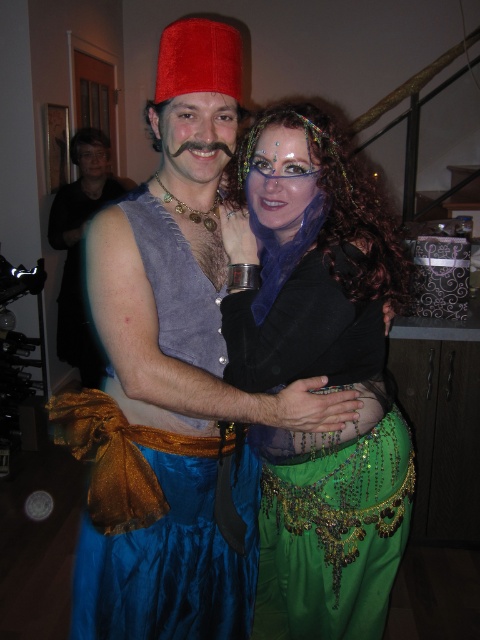
Is green sequined skirt at center further to the viewer compared to blue satin vest at center?

No, it is in front of blue satin vest at center.

Identify the location of green sequined skirt at center. The width and height of the screenshot is (480, 640). (322, 372).

Find the location of a particular element. This screenshot has height=640, width=480. green sequined skirt at center is located at coordinates (322, 372).

The height and width of the screenshot is (640, 480). Find the location of `green sequined skirt at center`. green sequined skirt at center is located at coordinates (322, 372).

Between point (363, 563) and point (187, 568), which one is positioned in front?

Positioned in front is point (187, 568).

How far apart are matte velvet fez at upper center and blue satin vest at center?

They are 9.06 centimeters apart.

Is point (342, 147) closer to camera compared to point (144, 230)?

No, (342, 147) is behind (144, 230).

Identify the location of matte velvet fez at upper center. (x=249, y=369).

Does point (408, 444) come behind point (95, 182)?

That is False.

Is green sequined skirt at center further to the viewer compared to shiny blue vest at center?

No, green sequined skirt at center is closer to the viewer.

Who is more distant from viewer, (247, 179) or (80, 310)?

The point (80, 310) is more distant.

What are the coordinates of `green sequined skirt at center` in the screenshot? It's located at (322, 372).